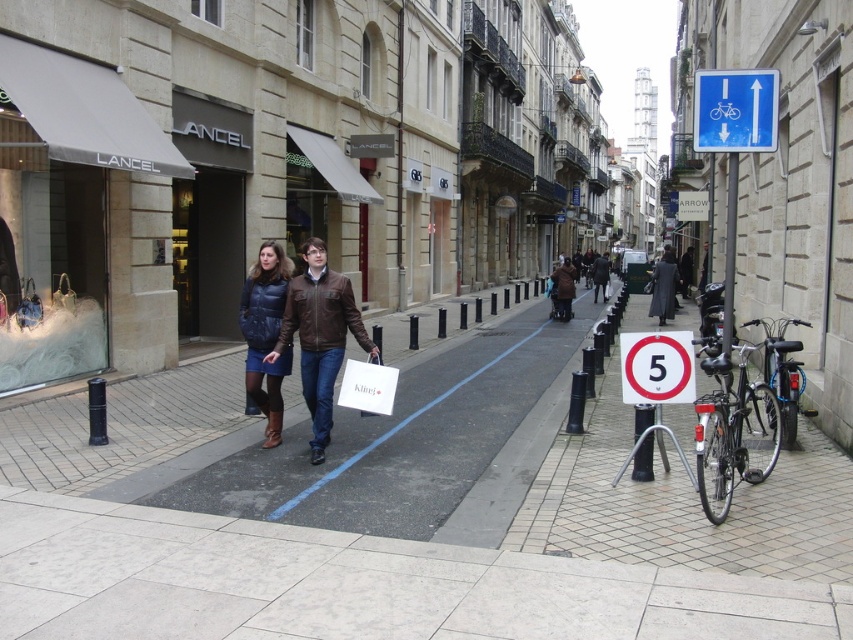
In the scene shown: Is blue plastic sign at upper right above matte blue puffer vest at center?

Yes, blue plastic sign at upper right is above matte blue puffer vest at center.

Where is `blue plastic sign at upper right`? The height and width of the screenshot is (640, 853). blue plastic sign at upper right is located at coordinates (735, 109).

Based on the photo, does blue plastic sign at upper right have a greater width compared to brown leather jacket at center?

In fact, blue plastic sign at upper right might be narrower than brown leather jacket at center.

Is point (701, 122) farther from viewer compared to point (560, 316)?

No.

Does point (728, 131) lie behind point (566, 285)?

No, (728, 131) is in front of (566, 285).

This screenshot has width=853, height=640. Find the location of `blue plastic sign at upper right`. blue plastic sign at upper right is located at coordinates (735, 109).

Who is positioned more to the right, blue plastic sign at upper right or white plastic sign at center?

Positioned to the right is blue plastic sign at upper right.

Can you confirm if blue plastic sign at upper right is taller than white plastic sign at center?

Yes.

Is point (738, 129) positioned after point (671, 332)?

Yes, it is.

This screenshot has width=853, height=640. In order to click on blue plastic sign at upper right in this screenshot , I will do `click(735, 109)`.